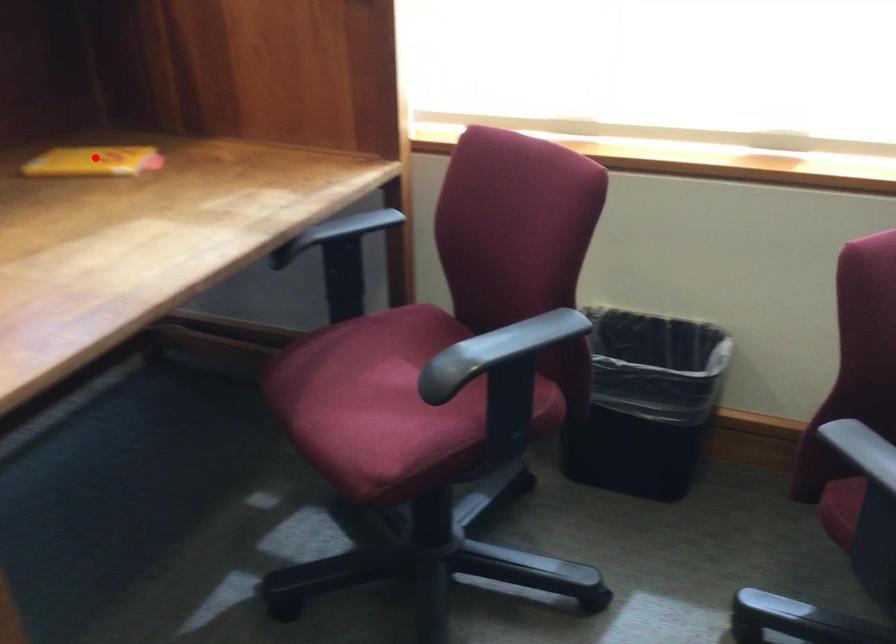
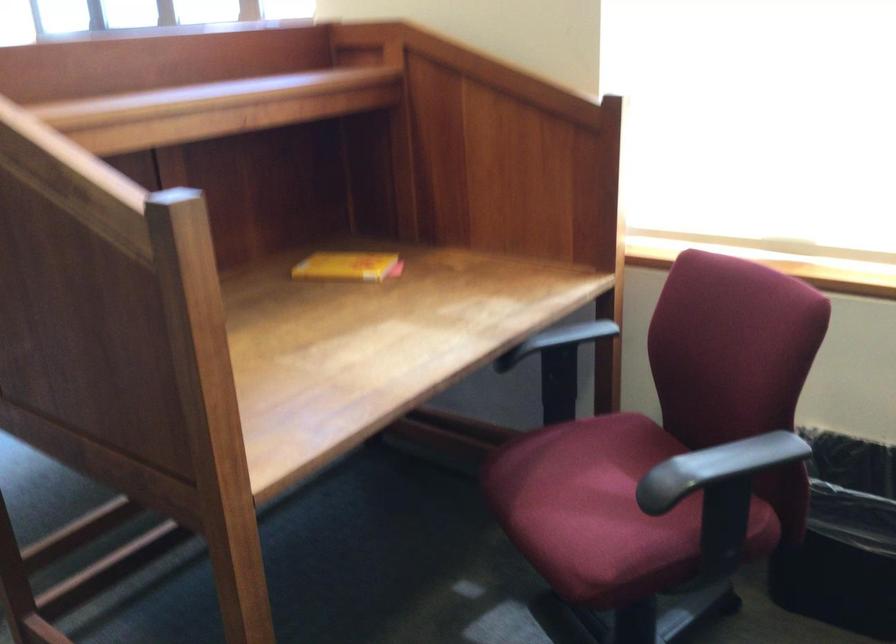
Question: I am providing you with two images of the same scene from different viewpoints. Image1 has a red point marked. In image2, the corresponding 3D location appears at what relative position? Reply with the corresponding letter.

Choices:
 (A) Closer
 (B) Farther

Answer: (B)